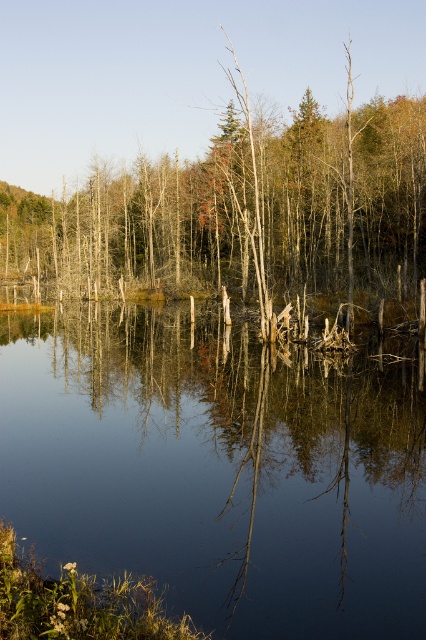
Question: Is smooth water at center below smooth bark tree at center?

Choices:
 (A) yes
 (B) no

Answer: (A)

Question: Does smooth water at center appear over smooth bark tree at center?

Choices:
 (A) no
 (B) yes

Answer: (A)

Question: Which of the following is the farthest from the observer?

Choices:
 (A) (281, 220)
 (B) (275, 500)

Answer: (A)

Question: Does smooth water at center appear on the right side of smooth bark tree at center?

Choices:
 (A) no
 (B) yes

Answer: (B)